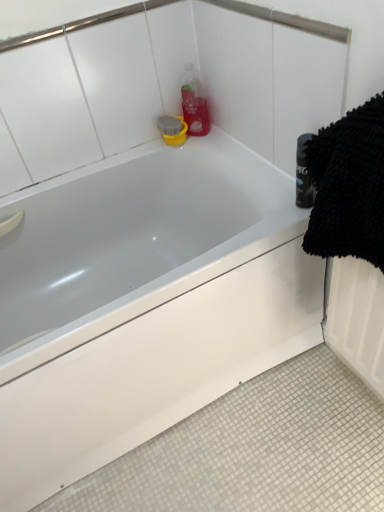
Where is `black microfiber towel at right`? The image size is (384, 512). black microfiber towel at right is located at coordinates (348, 186).

The image size is (384, 512). Find the location of `black microfiber towel at right`. black microfiber towel at right is located at coordinates (348, 186).

Is there a large distance between black microfiber towel at right and translucent plastic bottle at upper center?

That's not correct — black microfiber towel at right is a little close to translucent plastic bottle at upper center.

From a real-world perspective, who is located lower, black microfiber towel at right or translucent plastic bottle at upper center?

black microfiber towel at right is physically lower.

Could you tell me if black microfiber towel at right is turned towards translucent plastic bottle at upper center?

No, black microfiber towel at right is not oriented towards translucent plastic bottle at upper center.

From the picture: Is white glossy bathtub at upper center bigger or smaller than black microfiber towel at right?

white glossy bathtub at upper center is bigger than black microfiber towel at right.

From the image's perspective, is white glossy bathtub at upper center under black microfiber towel at right?

Yes, from the image's perspective, white glossy bathtub at upper center is below black microfiber towel at right.

Is white glossy bathtub at upper center surrounding black microfiber towel at right?

Definitely not — black microfiber towel at right is not inside white glossy bathtub at upper center.

Is black microfiber towel at right thinner than white glossy bathtub at upper center?

Yes.

What's the angular difference between black microfiber towel at right and white glossy bathtub at upper center's facing directions?

89.2 degrees.

Locate an element on the screen. Image resolution: width=384 pixels, height=512 pixels. bathtub on the left of black microfiber towel at right is located at coordinates (142, 302).

Which is closer, (190, 111) or (313, 140)?

Point (190, 111) is farther from the camera than point (313, 140).

Would you consider translucent plastic bottle at upper center to be distant from black microfiber towel at right?

No, translucent plastic bottle at upper center is not far away from black microfiber towel at right.

Is translucent plastic bottle at upper center bigger or smaller than black microfiber towel at right?

In the image, translucent plastic bottle at upper center appears to be smaller than black microfiber towel at right.

Is translucent plastic bottle at upper center wider than black microfiber towel at right?

No.

In the scene shown: Do you think white glossy bathtub at upper center is within translucent plastic bottle at upper center, or outside of it?

white glossy bathtub at upper center cannot be found inside translucent plastic bottle at upper center.

Considering the positions of points (11, 304) and (193, 72), is point (11, 304) closer to camera compared to point (193, 72)?

No, (11, 304) is behind (193, 72).

Relative to translucent plastic bottle at upper center, is white glossy bathtub at upper center in front or behind?

white glossy bathtub at upper center is positioned closer to the viewer than translucent plastic bottle at upper center.

Based on the photo, from the image's perspective, is white glossy bathtub at upper center above or below translucent plastic bottle at upper center?

white glossy bathtub at upper center is below translucent plastic bottle at upper center.

Which is more to the left, translucent plastic bottle at upper center or white glossy bathtub at upper center?

white glossy bathtub at upper center.

Is translucent plastic bottle at upper center in front of or behind white glossy bathtub at upper center in the image?

translucent plastic bottle at upper center is positioned farther from the viewer than white glossy bathtub at upper center.

Who is taller, translucent plastic bottle at upper center or white glossy bathtub at upper center?

With more height is white glossy bathtub at upper center.

Where is `cleaning product above the black microfiber towel at right (from a real-world perspective)`? cleaning product above the black microfiber towel at right (from a real-world perspective) is located at coordinates (194, 102).

This screenshot has height=512, width=384. In order to click on bathtub below the black microfiber towel at right (from a real-world perspective) in this screenshot , I will do `click(142, 302)`.

Consider the image. Estimate the real-world distances between objects in this image. Which object is closer to translucent plastic bottle at upper center, white glossy bathtub at upper center or black microfiber towel at right?

white glossy bathtub at upper center is closer to translucent plastic bottle at upper center.

Which object lies further to the anchor point white glossy bathtub at upper center, black microfiber towel at right or translucent plastic bottle at upper center?

The object further to white glossy bathtub at upper center is translucent plastic bottle at upper center.

Based on their spatial positions, is black microfiber towel at right or white glossy bathtub at upper center further from translucent plastic bottle at upper center?

Among the two, black microfiber towel at right is located further to translucent plastic bottle at upper center.

Estimate the real-world distances between objects in this image. Which object is closer to black microfiber towel at right, translucent plastic bottle at upper center or white glossy bathtub at upper center?

white glossy bathtub at upper center is closer to black microfiber towel at right.

Which object lies nearer to the anchor point white glossy bathtub at upper center, translucent plastic bottle at upper center or black microfiber towel at right?

black microfiber towel at right lies closer to white glossy bathtub at upper center than the other object.

Based on their spatial positions, is white glossy bathtub at upper center or translucent plastic bottle at upper center further from black microfiber towel at right?

The object further to black microfiber towel at right is translucent plastic bottle at upper center.

Identify the location of bathtub between black microfiber towel at right and translucent plastic bottle at upper center in the front-back direction. (142, 302).